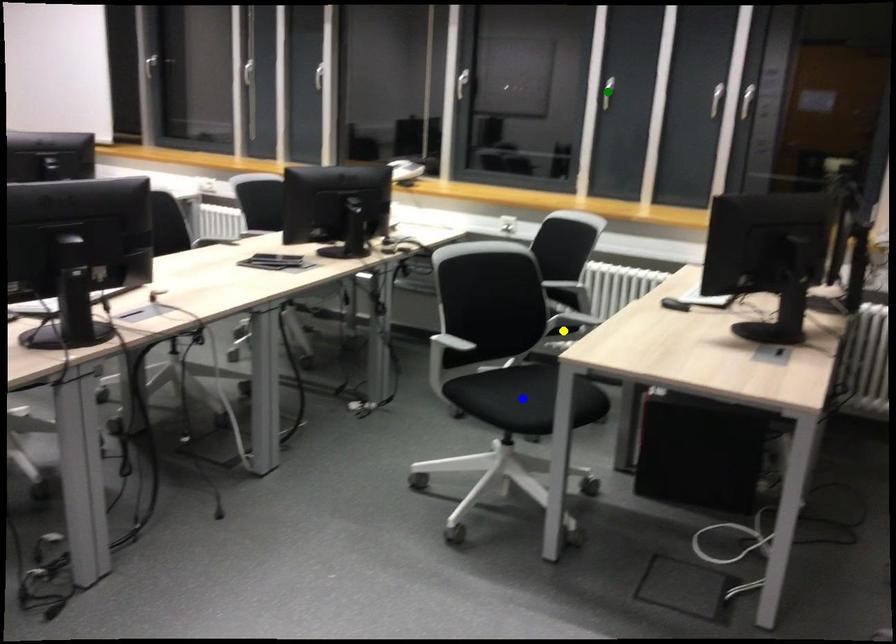
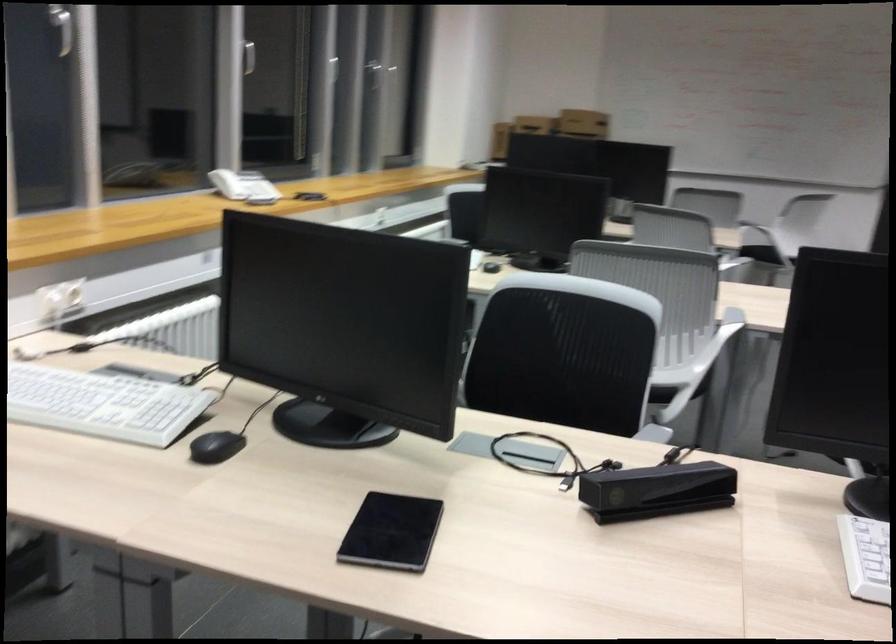
I am providing you with two images of the same scene from different viewpoints. Three points are marked in image1. Which point corresponds to a part or object that is occluded in image2?In image1, three points are marked. Which of them correspond to a part or object that is occluded in image2?Among the three points shown in image1, which one corresponds to a part or object that is no longer visible due to occlusion in image2?

blue point, yellow point, green point cannot be seen in image2.